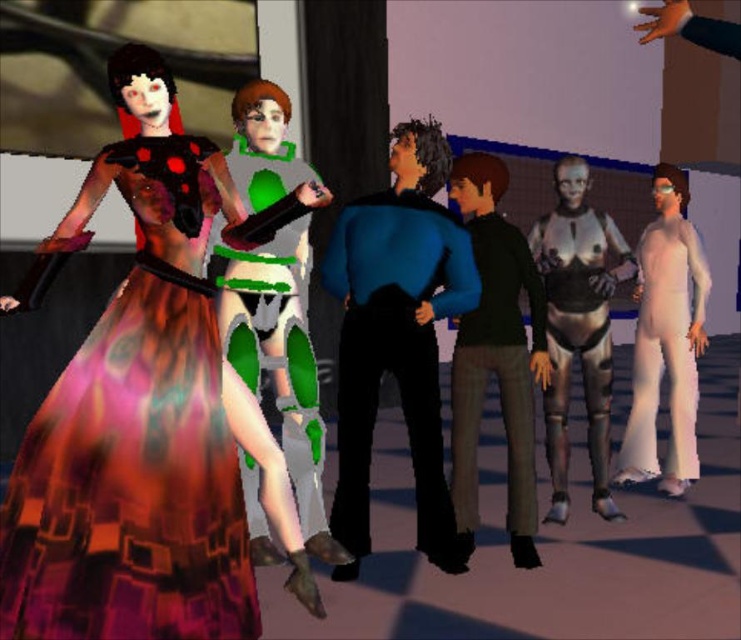
This screenshot has width=741, height=640. What do you see at coordinates (282, 362) in the screenshot?
I see `green matte armor at center` at bounding box center [282, 362].

Between point (308, 385) and point (562, 387), which one is positioned behind?

The point (562, 387) is more distant.

Where is `green matte armor at center`? The image size is (741, 640). green matte armor at center is located at coordinates tap(282, 362).

Can you confirm if multicolored fabric dress at left is positioned below green matte armor at center?

Correct, multicolored fabric dress at left is located below green matte armor at center.

Which is above, multicolored fabric dress at left or green matte armor at center?

green matte armor at center is higher up.

Image resolution: width=741 pixels, height=640 pixels. In order to click on multicolored fabric dress at left in this screenshot , I will do `click(136, 448)`.

Where is `multicolored fabric dress at left`? Image resolution: width=741 pixels, height=640 pixels. multicolored fabric dress at left is located at coordinates (136, 448).

Between metallic silver suit at center and white matte jumpsuit at right, which one has more height?

metallic silver suit at center is taller.

Is metallic silver suit at center further to the viewer compared to white matte jumpsuit at right?

No, it is in front of white matte jumpsuit at right.

Is point (542, 243) more distant than point (684, 369)?

No.

At what (x,y) coordinates should I click in order to perform the action: click on metallic silver suit at center. Please return your answer as a coordinate pair (x, y). The image size is (741, 640). Looking at the image, I should click on (578, 326).